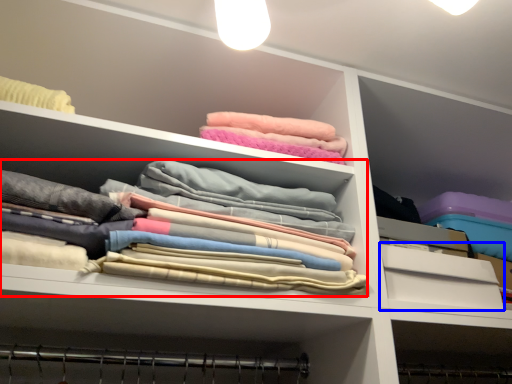
Question: Among these objects, which one is farthest to the camera, clothing (highlighted by a red box) or drawer (highlighted by a blue box)?

Choices:
 (A) clothing
 (B) drawer

Answer: (B)